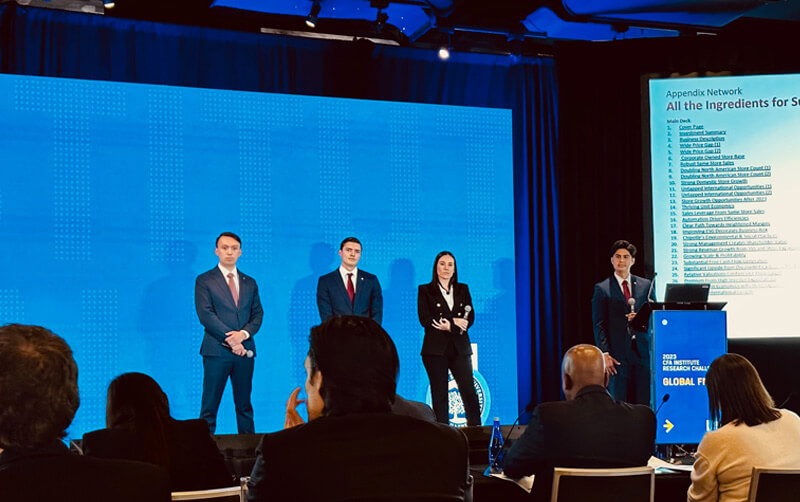
I want to click on light, so click(446, 53), click(316, 25), click(110, 4).